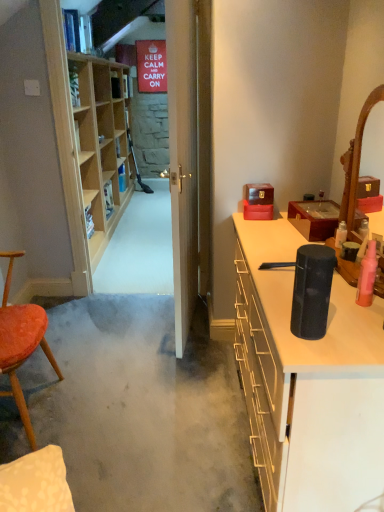
Question: In terms of height, does wooden mirror at right look taller or shorter compared to black matte speaker at right, the second cabinetry positioned from the top?

Choices:
 (A) tall
 (B) short

Answer: (B)

Question: From the image's perspective, is wooden mirror at right located above or below black matte speaker at right, the first cabinetry in the bottom-to-top sequence?

Choices:
 (A) below
 (B) above

Answer: (B)

Question: Estimate the real-world distances between objects in this image. Which object is closer to the wooden mirror at right?

Choices:
 (A) white wooden door at center
 (B) pink matte bottle at right
 (C) velvet orange chair at left
 (D) light wood shelf at left
 (E) black matte speaker at right, the first cabinetry in the bottom-to-top sequence

Answer: (B)

Question: Which of these objects is positioned farthest from the pink matte bottle at right?

Choices:
 (A) black matte speaker at right, the second cabinetry positioned from the top
 (B) light wood shelf at left
 (C) velvet orange chair at left
 (D) white wooden door at center
 (E) wooden mirror at right

Answer: (B)